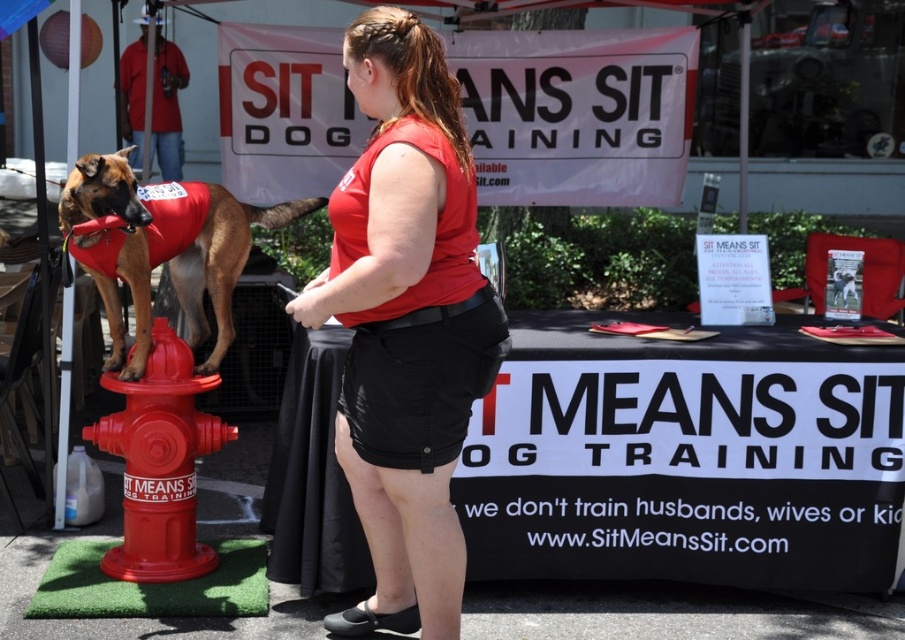
Which is more to the left, matte red shirt at center or shiny plastic fire hydrant at lower left?

shiny plastic fire hydrant at lower left

Is matte red shirt at center smaller than shiny plastic fire hydrant at lower left?

Actually, matte red shirt at center might be larger than shiny plastic fire hydrant at lower left.

At what (x,y) coordinates should I click in order to perform the action: click on matte red shirt at center. Please return your answer as a coordinate pair (x, y). The height and width of the screenshot is (640, 905). Looking at the image, I should click on (406, 323).

Who is positioned more to the right, matte red shirt at center or matte red vest at left?

matte red shirt at center

Who is more distant from viewer, (370,500) or (89,204)?

The point (89,204) is more distant.

Image resolution: width=905 pixels, height=640 pixels. What are the coordinates of `matte red shirt at center` in the screenshot? It's located at (406, 323).

Does point (163, 200) lie behind point (129, 385)?

That is True.

Between matte red vest at left and shiny plastic fire hydrant at lower left, which one is positioned higher?

matte red vest at left

Identify the location of matte red vest at left. (163, 248).

At what (x,y) coordinates should I click in order to perform the action: click on matte red vest at left. Please return your answer as a coordinate pair (x, y). Image resolution: width=905 pixels, height=640 pixels. Looking at the image, I should click on (163, 248).